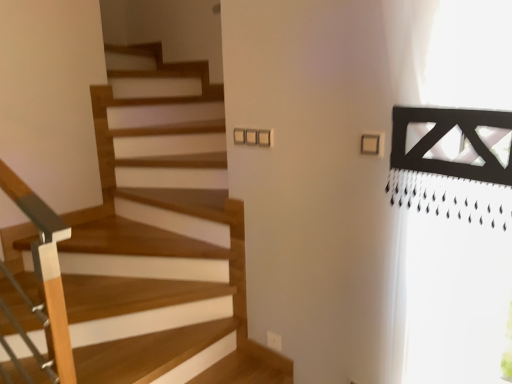
I want to click on black metal curtain at upper right, so click(x=451, y=277).

This screenshot has width=512, height=384. Describe the element at coordinates (451, 277) in the screenshot. I see `black metal curtain at upper right` at that location.

Identify the location of black metal curtain at upper right. This screenshot has height=384, width=512. (451, 277).